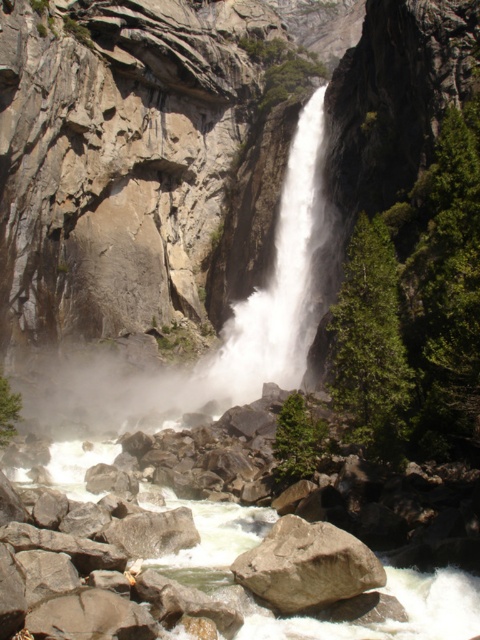
Question: Which point is farther from the camera taking this photo?

Choices:
 (A) (279, 602)
 (B) (308, 253)
 (C) (81, 486)

Answer: (B)

Question: Estimate the real-world distances between objects in this image. Which object is closer to the white smooth river at center?

Choices:
 (A) white frothy water at center
 (B) brown rough rock at center

Answer: (B)

Question: Where is white smooth river at center located in relation to brown rough rock at center in the image?

Choices:
 (A) below
 (B) above

Answer: (A)

Question: In this image, where is white frothy water at center located relative to brown rough rock at center?

Choices:
 (A) below
 (B) above

Answer: (B)

Question: Can you confirm if white frothy water at center is positioned to the left of white smooth river at center?

Choices:
 (A) yes
 (B) no

Answer: (B)

Question: Which object is closer to the camera taking this photo?

Choices:
 (A) white smooth river at center
 (B) brown rough rock at center
 (C) white frothy water at center

Answer: (A)